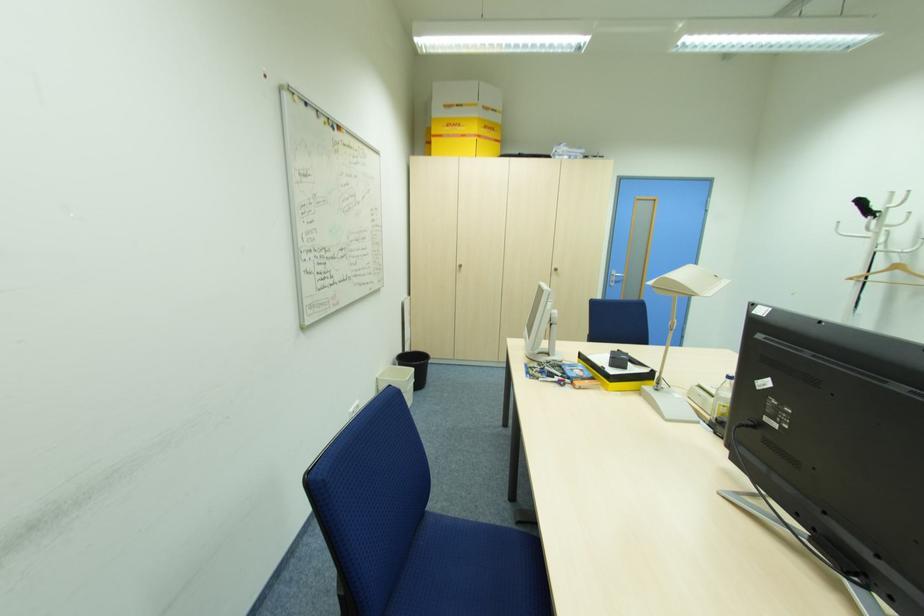
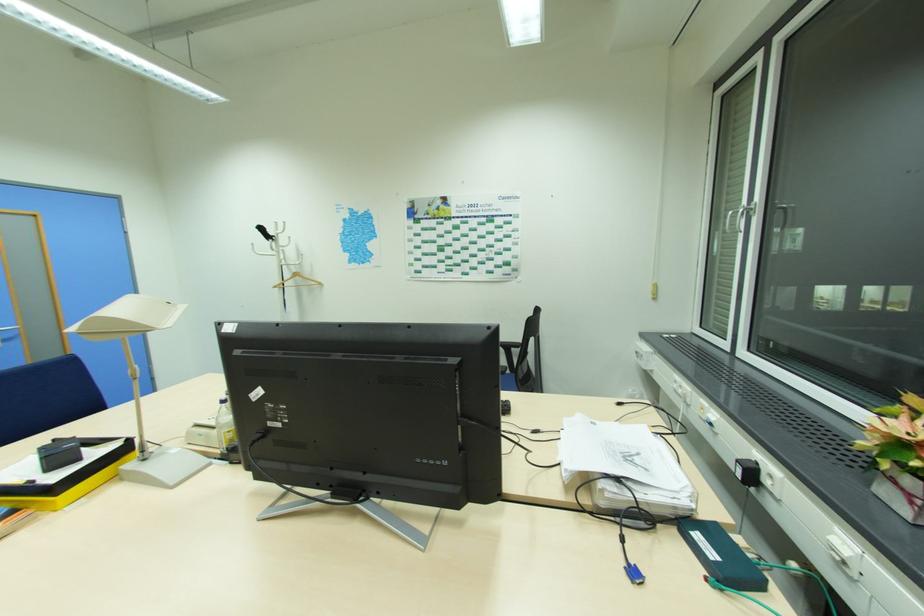
Locate, in the second image, the point that corresponds to (x=854, y=278) in the first image.

(277, 286)